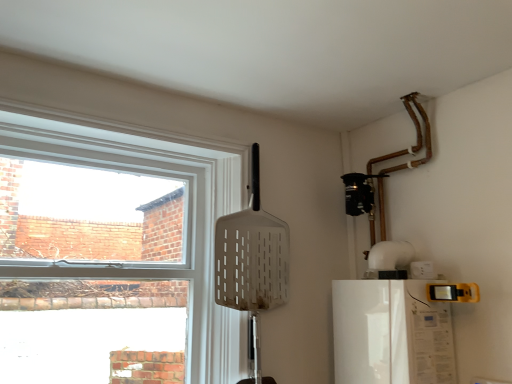
Question: Can clear glass window at upper left be found inside white glossy refrigerator at lower right?

Choices:
 (A) no
 (B) yes

Answer: (A)

Question: From a real-world perspective, is white glossy refrigerator at lower right located higher than clear glass window at upper left?

Choices:
 (A) no
 (B) yes

Answer: (A)

Question: Is white glossy refrigerator at lower right oriented towards clear glass window at upper left?

Choices:
 (A) yes
 (B) no

Answer: (A)

Question: From the image's perspective, is white glossy refrigerator at lower right over clear glass window at upper left?

Choices:
 (A) no
 (B) yes

Answer: (A)

Question: Is the depth of white glossy refrigerator at lower right less than that of clear glass window at upper left?

Choices:
 (A) no
 (B) yes

Answer: (A)

Question: Can you confirm if white glossy refrigerator at lower right is wider than clear glass window at upper left?

Choices:
 (A) no
 (B) yes

Answer: (B)

Question: Does clear glass window at upper left appear on the left side of white glossy refrigerator at lower right?

Choices:
 (A) no
 (B) yes

Answer: (B)

Question: Is clear glass window at upper left wider than white glossy refrigerator at lower right?

Choices:
 (A) yes
 (B) no

Answer: (B)

Question: Considering the relative sizes of clear glass window at upper left and white glossy refrigerator at lower right in the image provided, is clear glass window at upper left shorter than white glossy refrigerator at lower right?

Choices:
 (A) no
 (B) yes

Answer: (A)

Question: Can you confirm if clear glass window at upper left is taller than white glossy refrigerator at lower right?

Choices:
 (A) no
 (B) yes

Answer: (B)

Question: Is clear glass window at upper left further to camera compared to white glossy refrigerator at lower right?

Choices:
 (A) no
 (B) yes

Answer: (A)

Question: From a real-world perspective, is clear glass window at upper left located beneath white glossy refrigerator at lower right?

Choices:
 (A) yes
 (B) no

Answer: (B)

Question: Considering the positions of clear glass window at upper left and white glossy refrigerator at lower right in the image, is clear glass window at upper left bigger or smaller than white glossy refrigerator at lower right?

Choices:
 (A) big
 (B) small

Answer: (A)